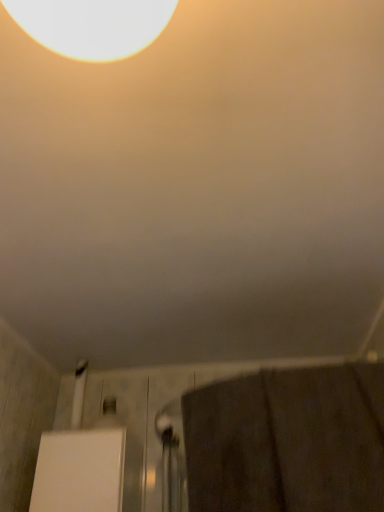
Question: Is brown textured towel at lower right at the right side of white glossy lampshade at upper left?

Choices:
 (A) yes
 (B) no

Answer: (A)

Question: Does brown textured towel at lower right appear on the left side of white glossy lampshade at upper left?

Choices:
 (A) no
 (B) yes

Answer: (A)

Question: From a real-world perspective, is brown textured towel at lower right physically below white glossy lampshade at upper left?

Choices:
 (A) no
 (B) yes

Answer: (B)

Question: From the image's perspective, is brown textured towel at lower right on white glossy lampshade at upper left?

Choices:
 (A) no
 (B) yes

Answer: (A)

Question: Can you confirm if brown textured towel at lower right is taller than white glossy lampshade at upper left?

Choices:
 (A) yes
 (B) no

Answer: (A)

Question: Is brown textured towel at lower right not close to white glossy lampshade at upper left?

Choices:
 (A) yes
 (B) no

Answer: (B)

Question: Does white glossy lampshade at upper left have a lesser height compared to brown textured towel at lower right?

Choices:
 (A) no
 (B) yes

Answer: (B)

Question: Is white glossy lampshade at upper left facing away from brown textured towel at lower right?

Choices:
 (A) yes
 (B) no

Answer: (B)

Question: Considering the relative positions of white glossy lampshade at upper left and brown textured towel at lower right in the image provided, is white glossy lampshade at upper left to the right of brown textured towel at lower right from the viewer's perspective?

Choices:
 (A) yes
 (B) no

Answer: (B)

Question: Does white glossy lampshade at upper left lie in front of brown textured towel at lower right?

Choices:
 (A) no
 (B) yes

Answer: (B)

Question: Are white glossy lampshade at upper left and brown textured towel at lower right beside each other?

Choices:
 (A) yes
 (B) no

Answer: (B)

Question: Is white glossy lampshade at upper left wider than brown textured towel at lower right?

Choices:
 (A) no
 (B) yes

Answer: (A)

Question: Relative to white glossy lampshade at upper left, is brown textured towel at lower right in front or behind?

Choices:
 (A) behind
 (B) front

Answer: (A)